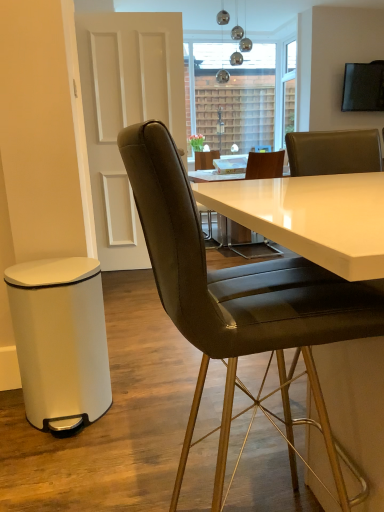
Question: Based on their positions, is leather/goldenchair at center located to the left or right of white glossy door at upper left?

Choices:
 (A) left
 (B) right

Answer: (B)

Question: Is leather/goldenchair at center wider or thinner than white glossy door at upper left?

Choices:
 (A) wide
 (B) thin

Answer: (A)

Question: Estimate the real-world distances between objects in this image. Which object is farther from the white glossy door at upper left?

Choices:
 (A) transparent glass window at upper center
 (B) leather/goldenchair at center
 (C) white matte bar stool at lower left

Answer: (B)

Question: Which object is positioned farthest from the transparent glass window at upper center?

Choices:
 (A) white glossy door at upper left
 (B) white matte bar stool at lower left
 (C) leather/goldenchair at center

Answer: (C)